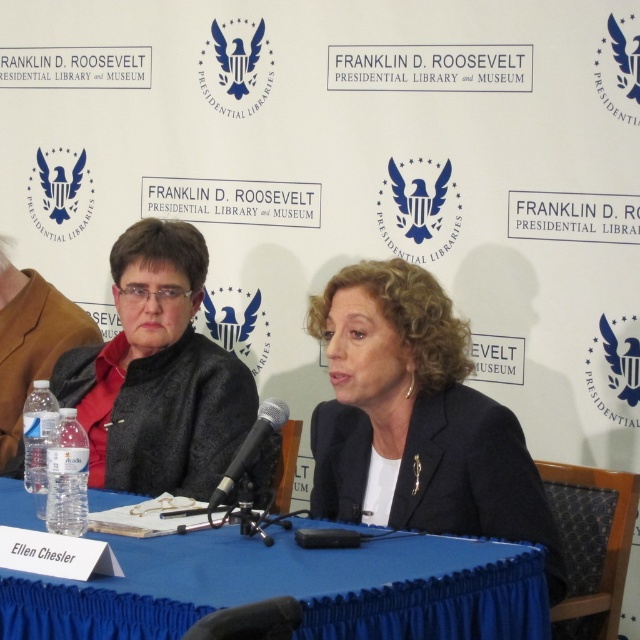
Question: Does dark blue suit at center have a lesser width compared to black metallic microphone at center?

Choices:
 (A) no
 (B) yes

Answer: (A)

Question: Does dark blue suit at center appear over matte black jacket at left?

Choices:
 (A) no
 (B) yes

Answer: (A)

Question: Which of the following is the farthest from the observer?

Choices:
 (A) (282, 413)
 (B) (13, 397)

Answer: (B)

Question: Can you confirm if dark blue suit at center is positioned below clear plastic water bottles at left?

Choices:
 (A) no
 (B) yes

Answer: (B)

Question: Which point is closer to the camera?

Choices:
 (A) clear plastic water bottles at left
 (B) black metallic microphone at center
 (C) dark blue suit at center

Answer: (B)

Question: Which object is farther from the camera taking this photo?

Choices:
 (A) clear plastic water bottles at left
 (B) blue fabric table at center
 (C) dark blue suit at center

Answer: (A)